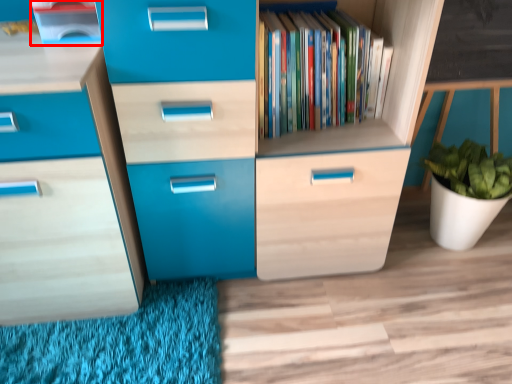
Question: Observing the image, what is the correct spatial positioning of cabinetry (annotated by the red box) in reference to shelf?

Choices:
 (A) left
 (B) right

Answer: (A)